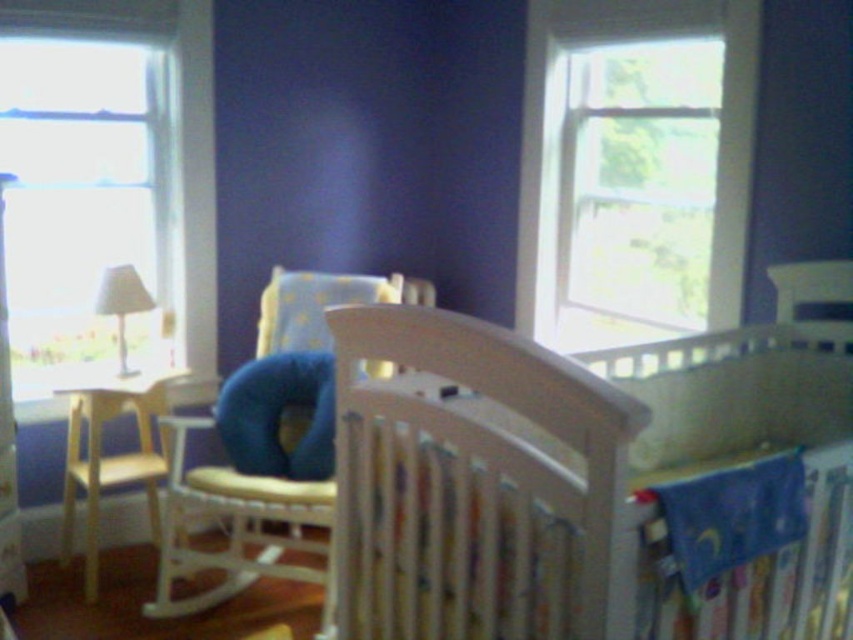
Between transparent glass window at upper right and white wood rocking chair at upper right, which one appears on the right side from the viewer's perspective?

white wood rocking chair at upper right

Is point (665, 240) positioned behind point (787, 269)?

That is True.

Measure the distance between point (689, 131) and camera.

The distance of point (689, 131) from camera is 8.82 feet.

This screenshot has height=640, width=853. What are the coordinates of `transparent glass window at upper right` in the screenshot? It's located at (635, 168).

Find the location of a particular element. This screenshot has width=853, height=640. white wooden crib at center is located at coordinates (560, 477).

Between point (376, 545) and point (132, 371), which one is positioned in front?

Positioned in front is point (376, 545).

The height and width of the screenshot is (640, 853). Find the location of `white wooden crib at center`. white wooden crib at center is located at coordinates (560, 477).

Who is lower down, light beige wood rocking chair at center or white wood rocking chair at upper right?

light beige wood rocking chair at center is lower down.

Which of these two, light beige wood rocking chair at center or white wood rocking chair at upper right, stands shorter?

white wood rocking chair at upper right

The height and width of the screenshot is (640, 853). I want to click on light beige wood rocking chair at center, so click(231, 525).

Locate an element on the screen. Image resolution: width=853 pixels, height=640 pixels. light beige wood rocking chair at center is located at coordinates (231, 525).